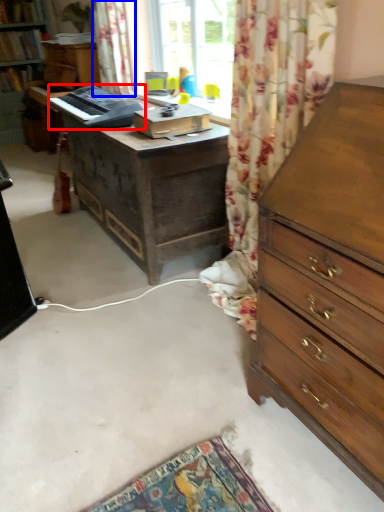
Question: Which of the following is the farthest to the observer, equipment (highlighted by a red box) or curtain (highlighted by a blue box)?

Choices:
 (A) equipment
 (B) curtain

Answer: (B)